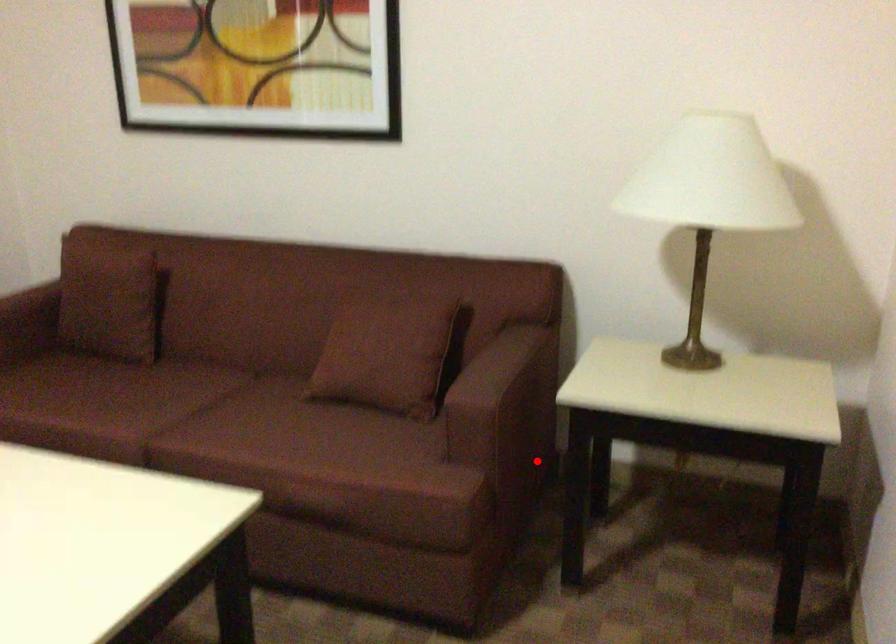
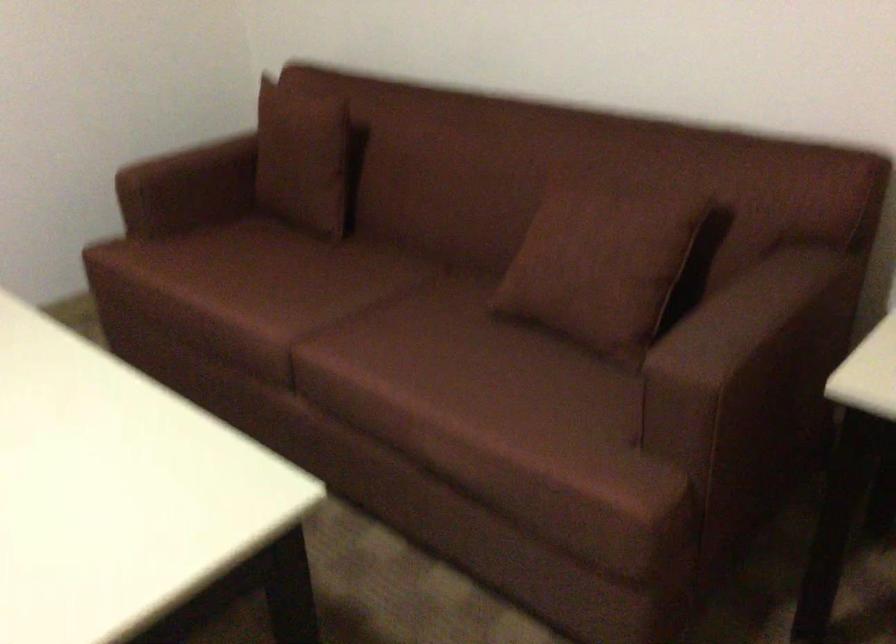
Find the pixel in the second image that matches the highlighted location in the first image.

(791, 446)